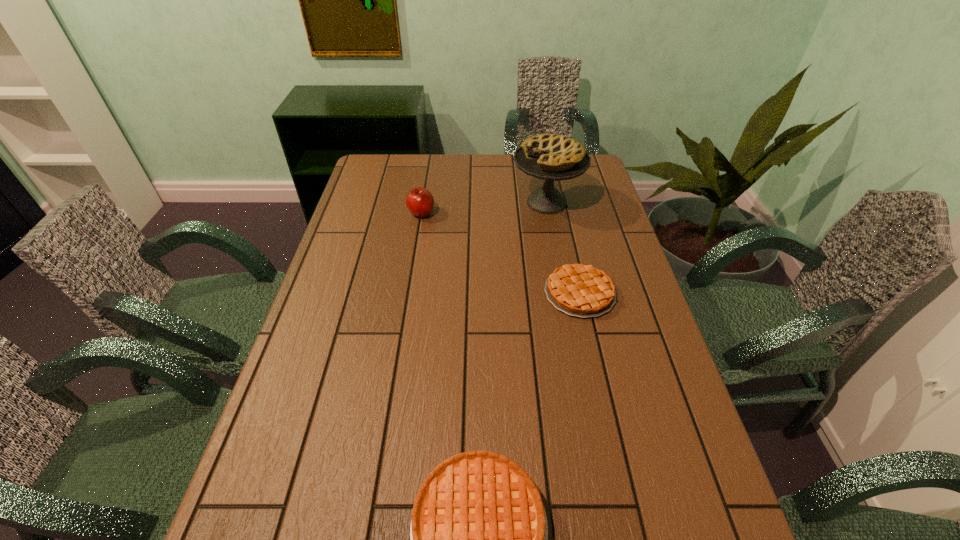
Find the location of `the farthest pie`. the farthest pie is located at coordinates (550, 157).

Where is `the tallest object`? the tallest object is located at coordinates (550, 157).

The height and width of the screenshot is (540, 960). What are the coordinates of `apple` in the screenshot? It's located at (420, 202).

Find the location of a particular element. the leftmost object is located at coordinates (420, 202).

Where is `the second nearest object`? This screenshot has width=960, height=540. the second nearest object is located at coordinates (579, 290).

Image resolution: width=960 pixels, height=540 pixels. I want to click on the second farthest pie, so click(x=579, y=290).

You are a GUI agent. You are given a task and a screenshot of the screen. Output one action in this format:
    pyautogui.click(x=<x>, y=<y>)
    Task: Click on the vacant space located 0.380m on the cut side of the farthest pie
    This screenshot has height=540, width=960.
    Given the screenshot: What is the action you would take?
    pyautogui.click(x=404, y=202)

This screenshot has height=540, width=960. In order to click on vacant area located on the cut side of the farthest pie in this screenshot , I will do `click(423, 202)`.

Image resolution: width=960 pixels, height=540 pixels. In order to click on free region located on the cut side of the farthest pie in this screenshot , I will do `click(496, 202)`.

Where is `vacant space located on the right of the apple`? vacant space located on the right of the apple is located at coordinates (478, 213).